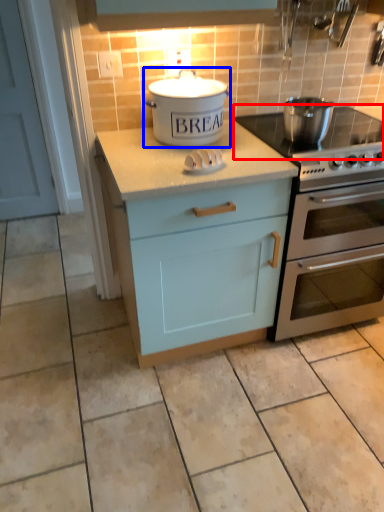
Question: Among these objects, which one is farthest to the camera, gas stove (highlighted by a red box) or kitchen appliance (highlighted by a blue box)?

Choices:
 (A) gas stove
 (B) kitchen appliance

Answer: (B)